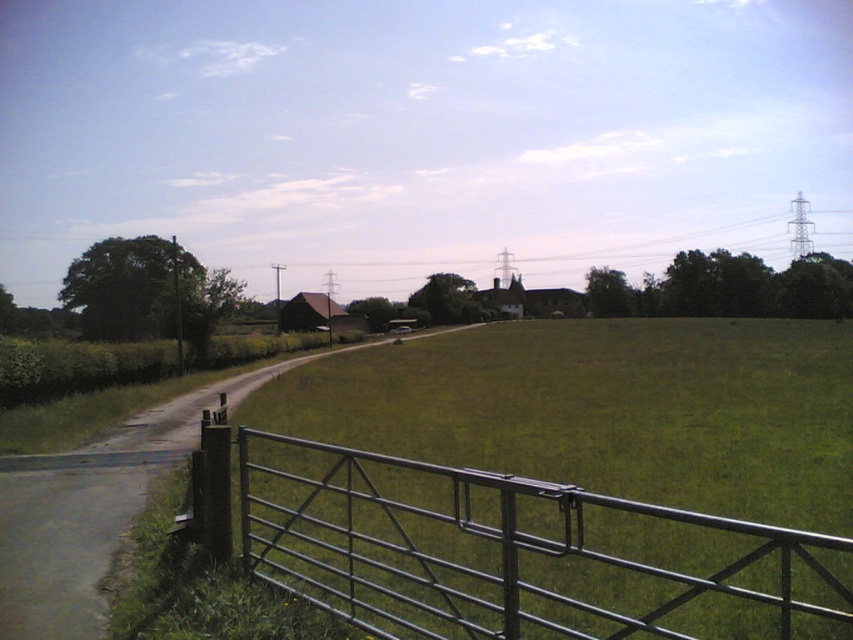
Does point (415, 476) lie in front of point (137, 476)?

No, it is not.

Can you confirm if metallic gate at lower center is positioned to the left of smooth asphalt road at center?

In fact, metallic gate at lower center is to the right of smooth asphalt road at center.

Which is in front, point (750, 554) or point (28, 582)?

Positioned in front is point (28, 582).

At what (x,y) coordinates should I click in order to perform the action: click on metallic gate at lower center. Please return your answer as a coordinate pair (x, y). The width and height of the screenshot is (853, 640). Looking at the image, I should click on (520, 554).